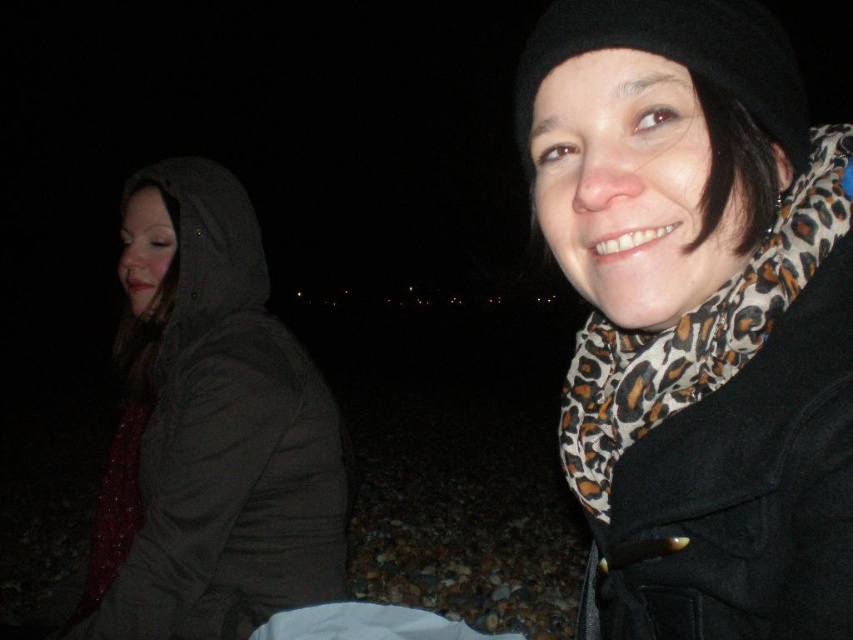
You are a photographer trying to capture a closeup shot of the leopard print scarf at upper right without the dark gray hooded jacket at left blocking the view. Given the distance between them, can you fit both subjects in the frame while keeping the scarf as the main focus?

The dark gray hooded jacket at left is 37.97 inches from the leopard print scarf at upper right. Since the jacket is relatively close to the scarf, it might partially block the view unless you adjust your angle or zoom in to focus solely on the scarf.

You are standing at the origin point of the image. You want to walk towards the dark gray hooded jacket at left. What direction should you move in?

The dark gray hooded jacket at left is located at coordinates point (x=213, y=428), so you should move towards the left and slightly upwards to reach it.